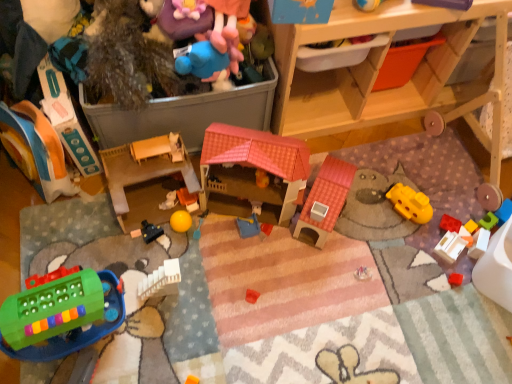
I want to click on vacant area that lies between smooth plastic toy at center, the ninth toy viewed from the right, and white plastic toy at lower right, positioned as the 4th toy in right-to-left order, so click(334, 235).